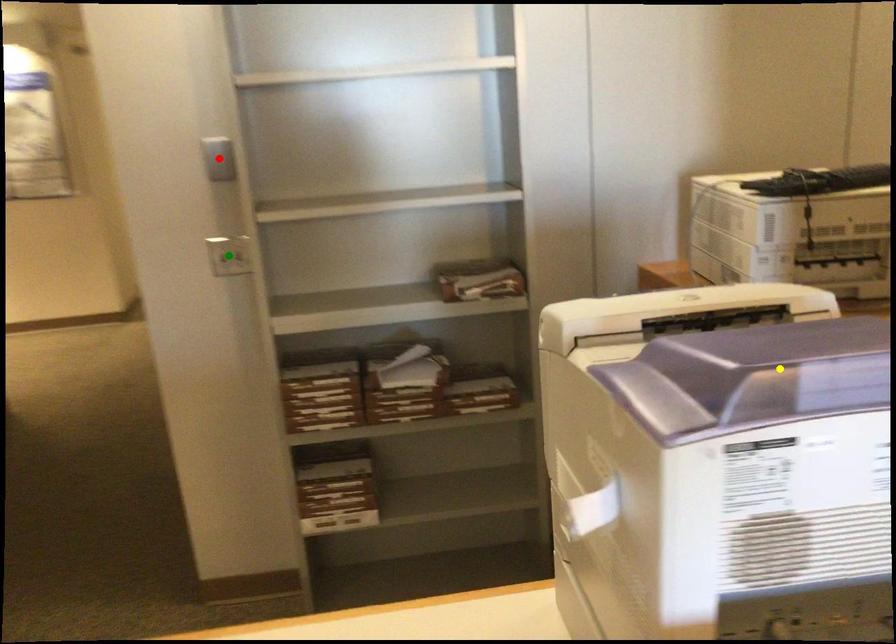
Order these from farthest to nearest:
red point | green point | yellow point

green point
red point
yellow point